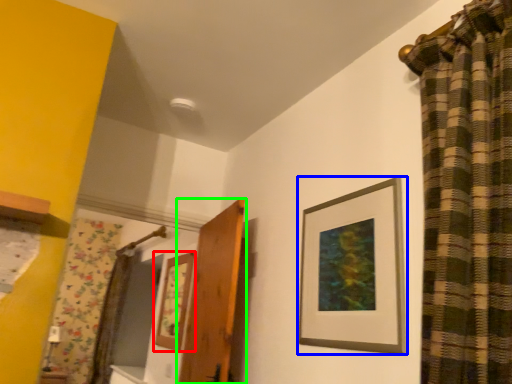
Question: Considering the real-world distances, which object is closest to picture frame (highlighted by a red box)? picture frame (highlighted by a blue box) or door (highlighted by a green box).

Choices:
 (A) picture frame
 (B) door

Answer: (B)